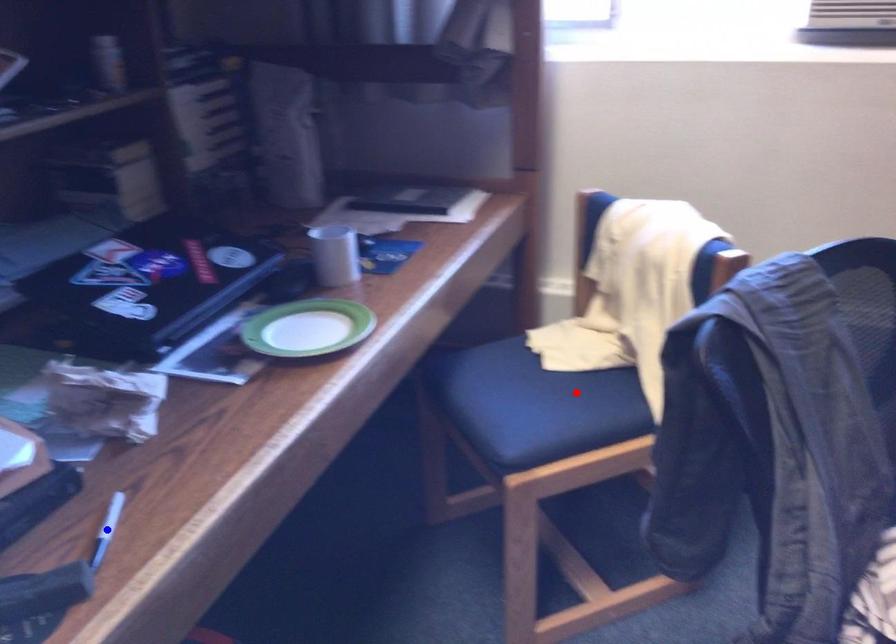
Question: Two points are marked on the image. Which point is closer to the camera?

Choices:
 (A) Blue point is closer.
 (B) Red point is closer.

Answer: (A)